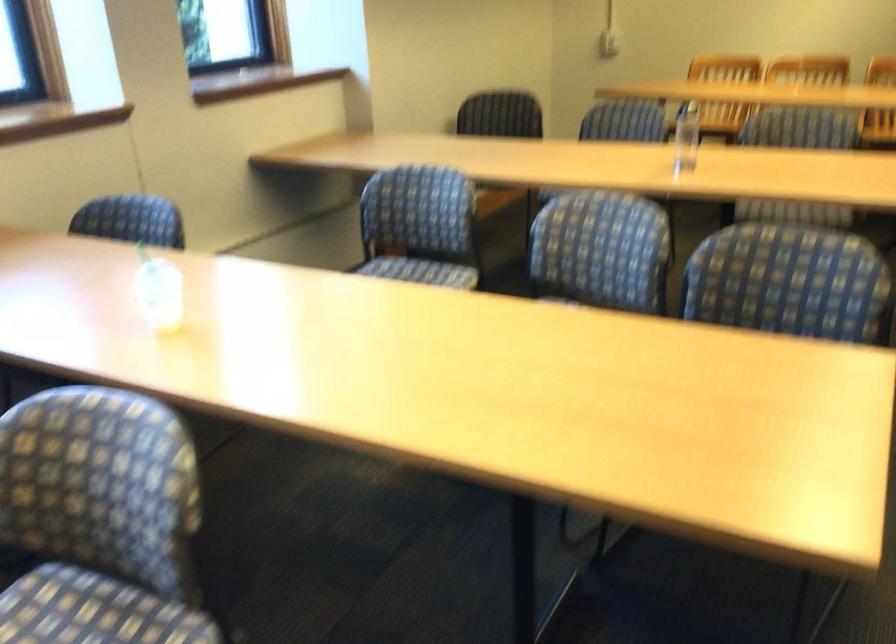
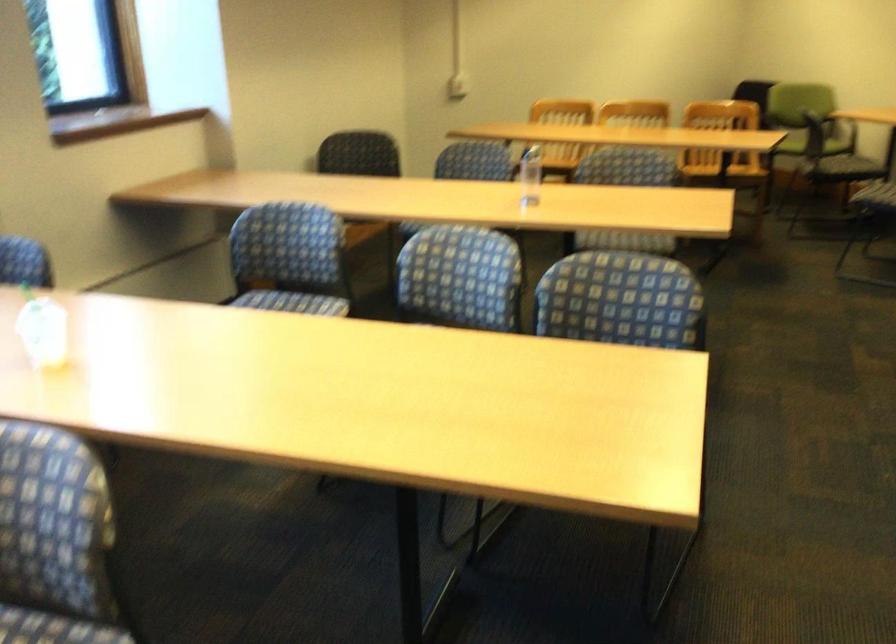
Find the pixel in the second image that matches [599,251] in the first image.

(460, 277)